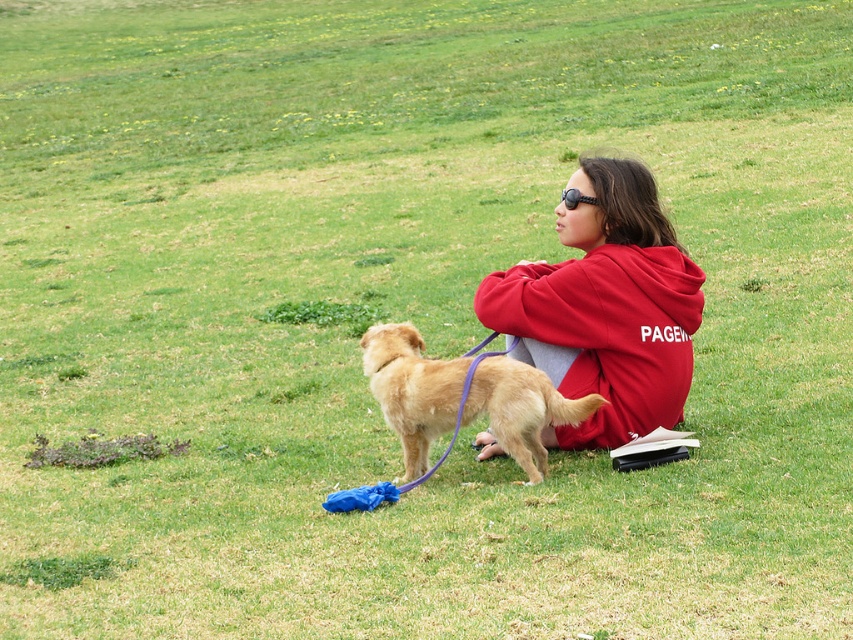
Question: Is red fleece sweatshirt at center smaller than golden fur dog at center?

Choices:
 (A) yes
 (B) no

Answer: (B)

Question: Does red fleece sweatshirt at center have a smaller size compared to golden fur dog at center?

Choices:
 (A) yes
 (B) no

Answer: (B)

Question: Is red fleece sweatshirt at center below golden fur dog at center?

Choices:
 (A) yes
 (B) no

Answer: (B)